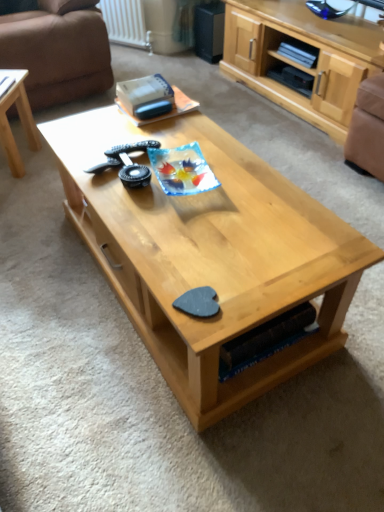
Locate an element on the screen. This screenshot has height=512, width=384. vacant area on top of natural wood coffee table at center, which is the 2th coffee table in left-to-right order (from a real-world perspective) is located at coordinates (200, 178).